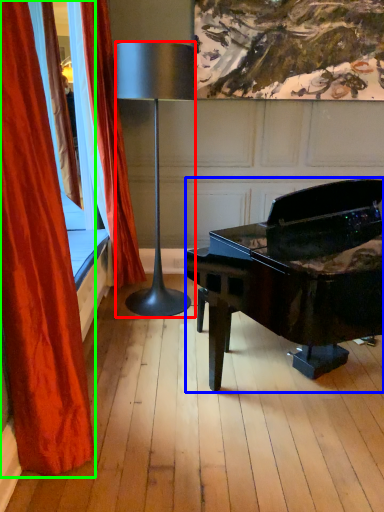
Question: Based on their relative distances, which object is farther from lamp (highlighted by a red box)? Choose from piano (highlighted by a blue box) and curtain (highlighted by a green box).

Choices:
 (A) piano
 (B) curtain

Answer: (B)